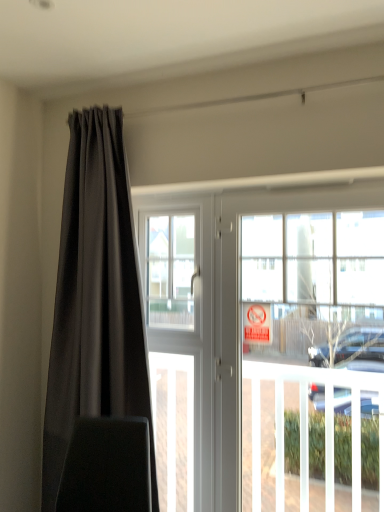
Question: Is red plastic sign at window positioned before transparent glass window screen at center?

Choices:
 (A) no
 (B) yes

Answer: (B)

Question: Does red plastic sign at window have a greater width compared to transparent glass window screen at center?

Choices:
 (A) no
 (B) yes

Answer: (A)

Question: Is red plastic sign at window to the right of transparent glass window screen at center from the viewer's perspective?

Choices:
 (A) no
 (B) yes

Answer: (B)

Question: Is red plastic sign at window oriented towards transparent glass window screen at center?

Choices:
 (A) yes
 (B) no

Answer: (B)

Question: Is transparent glass window screen at center at the back of red plastic sign at window?

Choices:
 (A) yes
 (B) no

Answer: (B)

Question: In terms of height, does matte black curtain at left look taller or shorter compared to white glossy door at center?

Choices:
 (A) short
 (B) tall

Answer: (B)

Question: Looking at their shapes, would you say matte black curtain at left is wider or thinner than white glossy door at center?

Choices:
 (A) wide
 (B) thin

Answer: (A)

Question: Considering the positions of point (94, 112) and point (220, 428), is point (94, 112) closer or farther from the camera than point (220, 428)?

Choices:
 (A) farther
 (B) closer

Answer: (B)

Question: Do you think matte black curtain at left is within white glossy door at center, or outside of it?

Choices:
 (A) inside
 (B) outside

Answer: (B)

Question: Does point (168, 236) appear closer or farther from the camera than point (261, 335)?

Choices:
 (A) closer
 (B) farther

Answer: (B)

Question: Is transparent glass window screen at center spatially inside red plastic sign at window, or outside of it?

Choices:
 (A) inside
 (B) outside

Answer: (B)

Question: In terms of height, does transparent glass window screen at center look taller or shorter compared to red plastic sign at window?

Choices:
 (A) tall
 (B) short

Answer: (A)

Question: From the image's perspective, is transparent glass window screen at center located above or below red plastic sign at window?

Choices:
 (A) below
 (B) above

Answer: (B)

Question: From the image's perspective, is velvet black swivel chair at left located above or below white glossy door at center?

Choices:
 (A) above
 (B) below

Answer: (B)

Question: Considering the positions of point (114, 480) and point (223, 289), is point (114, 480) closer or farther from the camera than point (223, 289)?

Choices:
 (A) closer
 (B) farther

Answer: (A)